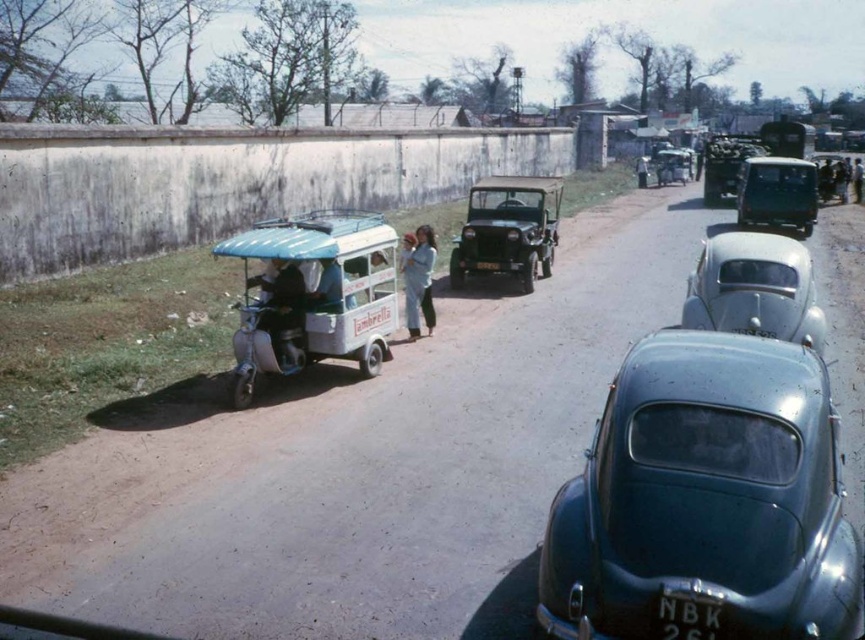
You are a pedestrian standing on the dirt road and want to cross to the other side. There are two cars in the center of the image, a metallic blue car at center and a silver metallic car at center. Which car is closer to the ground?

The metallic blue car at center is below the silver metallic car at center, so the metallic blue car at center is closer to the ground.

Based on the photo, you are a delivery person needing to load a heavy package onto the light blue plastic rickshaw at left. The package is too tall to fit under the metallic blue car at center. Is the rickshaw positioned in a way that allows you to lift the package over the car?

The metallic blue car at center is below the light blue plastic rickshaw at left, meaning the rickshaw is higher up. This allows you to lift the package over the car since the rickshaw is positioned above the car.